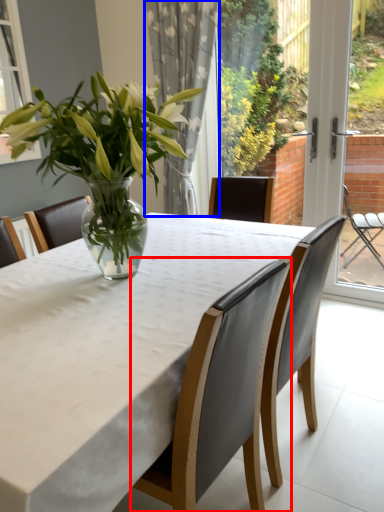
Question: Which point is closer to the camera, chair (highlighted by a red box) or curtain (highlighted by a blue box)?

Choices:
 (A) chair
 (B) curtain

Answer: (A)